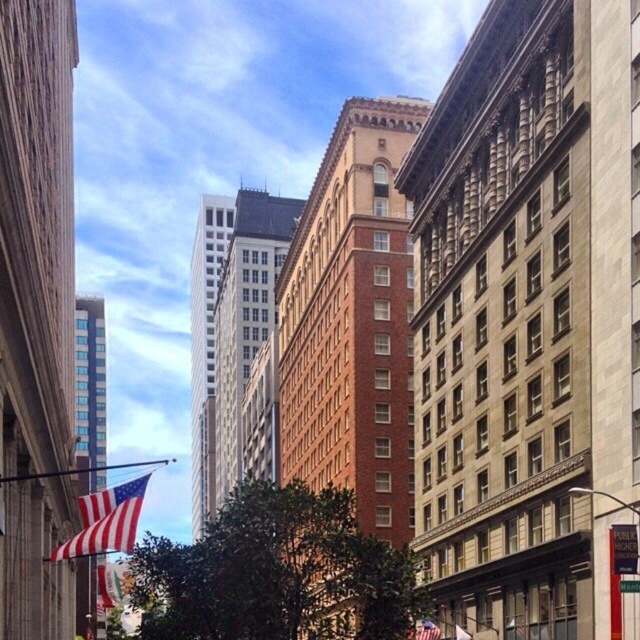
You are standing at point (x=120, y=548) and want to walk to the nearest building entrance. The red brick building in the center has an entrance 135.38 feet away from your current position. Is this entrance closer than the entrance of the modern skyscraper on the right?

The entrance of the red brick building in the center is 135.38 feet away from point (x=120, y=548). Since the modern skyscraper on the right is not mentioned in the Objects Description, we cannot determine its distance. Therefore, the red brick building entrance is the closest known option.